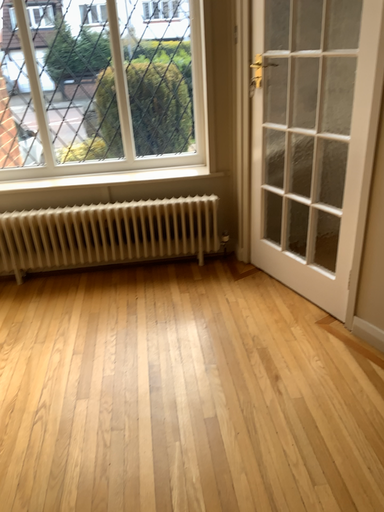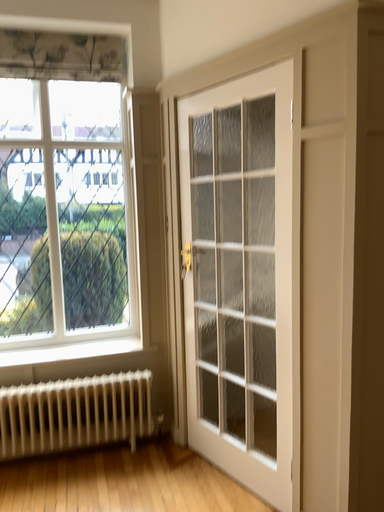
Question: How did the camera likely rotate when shooting the video?

Choices:
 (A) rotated left
 (B) rotated right

Answer: (B)